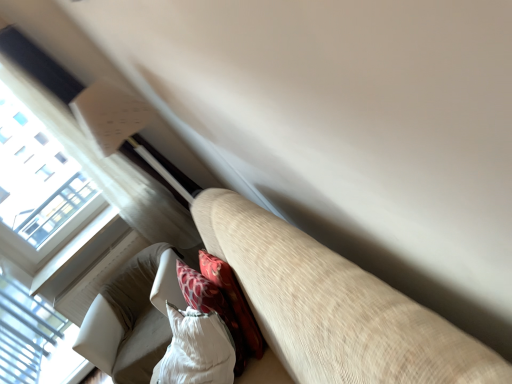
Question: From a real-world perspective, is white textured bean bag chair at lower center, positioned as the first bean bag chair in front-to-back order, below white plastic window at lower left?

Choices:
 (A) yes
 (B) no

Answer: (B)

Question: Can you confirm if white textured bean bag chair at lower center, acting as the 2th bean bag chair starting from the back, is shorter than white plastic window at lower left?

Choices:
 (A) yes
 (B) no

Answer: (A)

Question: Can you confirm if white textured bean bag chair at lower center, acting as the 2th bean bag chair starting from the back, is smaller than white plastic window at lower left?

Choices:
 (A) no
 (B) yes

Answer: (A)

Question: Is white textured bean bag chair at lower center, acting as the 2th bean bag chair starting from the back, not close to white plastic window at lower left?

Choices:
 (A) no
 (B) yes

Answer: (B)

Question: From a real-world perspective, is white textured bean bag chair at lower center, acting as the 2th bean bag chair starting from the back, over white plastic window at lower left?

Choices:
 (A) yes
 (B) no

Answer: (A)

Question: Is white textured bean bag chair at lower center, positioned as the first bean bag chair in front-to-back order, directly adjacent to white plastic window at lower left?

Choices:
 (A) yes
 (B) no

Answer: (B)

Question: Is white textured bean bag chair at lower center, positioned as the first bean bag chair in front-to-back order, at the back of white textured bean bag chair at lower left, which ranks as the first bean bag chair in back-to-front order?

Choices:
 (A) yes
 (B) no

Answer: (B)

Question: Does white textured bean bag chair at lower left, arranged as the 2th bean bag chair when viewed from the front, come in front of white textured bean bag chair at lower center, acting as the 2th bean bag chair starting from the back?

Choices:
 (A) no
 (B) yes

Answer: (A)

Question: Considering the relative sizes of white textured bean bag chair at lower left, arranged as the 2th bean bag chair when viewed from the front, and white textured bean bag chair at lower center, acting as the 2th bean bag chair starting from the back, in the image provided, is white textured bean bag chair at lower left, arranged as the 2th bean bag chair when viewed from the front, bigger than white textured bean bag chair at lower center, acting as the 2th bean bag chair starting from the back,?

Choices:
 (A) yes
 (B) no

Answer: (A)

Question: From a real-world perspective, is white textured bean bag chair at lower left, arranged as the 2th bean bag chair when viewed from the front, located higher than white textured bean bag chair at lower center, acting as the 2th bean bag chair starting from the back?

Choices:
 (A) no
 (B) yes

Answer: (A)

Question: Is there a large distance between white textured bean bag chair at lower left, arranged as the 2th bean bag chair when viewed from the front, and white textured bean bag chair at lower center, positioned as the first bean bag chair in front-to-back order?

Choices:
 (A) yes
 (B) no

Answer: (B)

Question: Is white textured bean bag chair at lower left, which ranks as the first bean bag chair in back-to-front order, thinner than white textured bean bag chair at lower center, positioned as the first bean bag chair in front-to-back order?

Choices:
 (A) no
 (B) yes

Answer: (A)

Question: Is white textured bean bag chair at lower left, arranged as the 2th bean bag chair when viewed from the front, at the back of white textured bean bag chair at lower center, positioned as the first bean bag chair in front-to-back order?

Choices:
 (A) no
 (B) yes

Answer: (A)